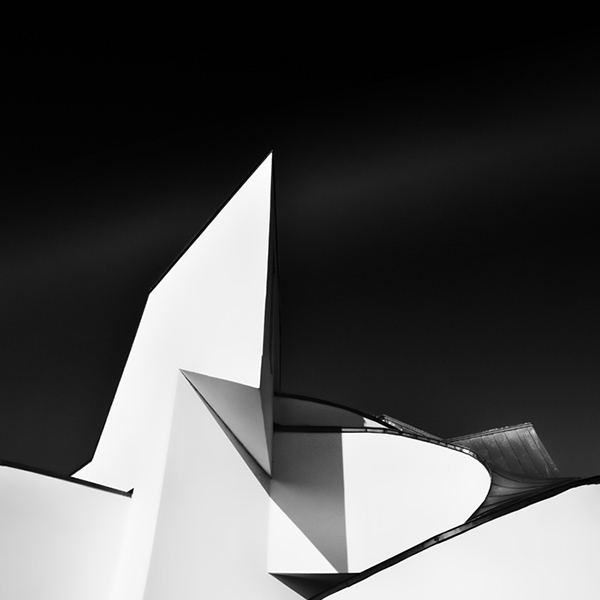
Locate an element on the screen. The width and height of the screenshot is (600, 600). black wall is located at coordinates (410, 248), (119, 85), (65, 298), (567, 401).